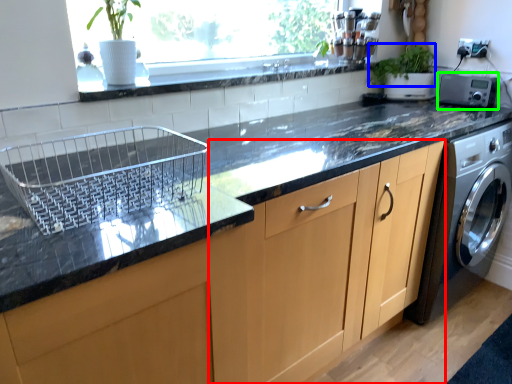
Question: Which object is the farthest from cabinetry (highlighted by a red box)? Choose among these: plant (highlighted by a blue box) or appliance (highlighted by a green box).

Choices:
 (A) plant
 (B) appliance

Answer: (A)